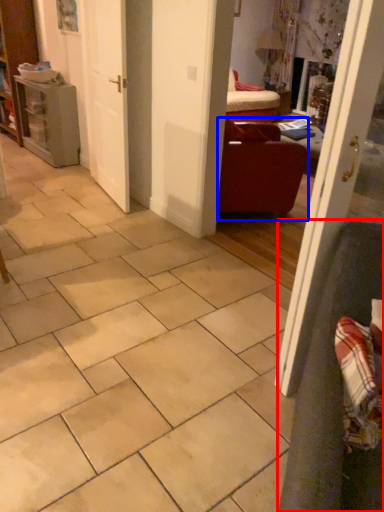
Question: Which point is further to the camera, armchair (highlighted by a red box) or furniture (highlighted by a blue box)?

Choices:
 (A) armchair
 (B) furniture

Answer: (B)